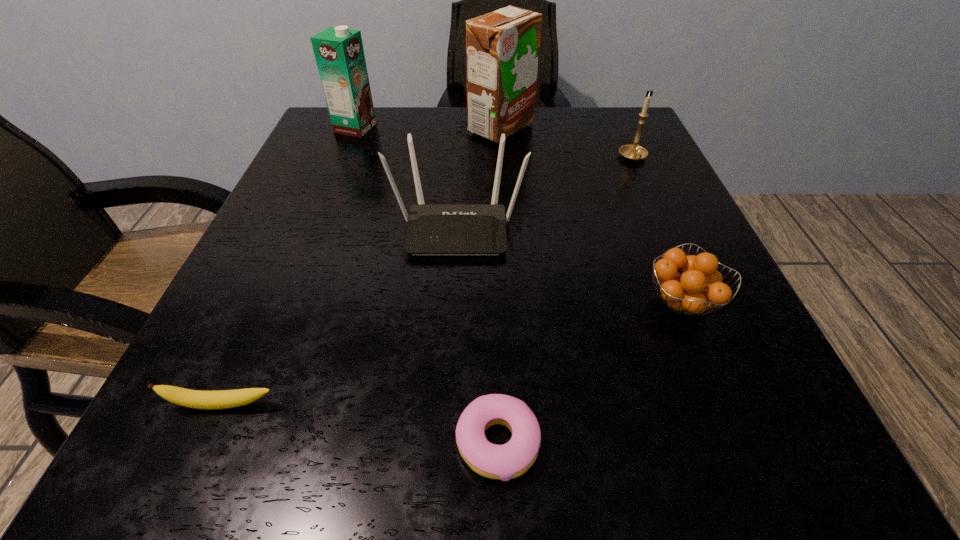
The height and width of the screenshot is (540, 960). What are the coordinates of `the right carton` in the screenshot? It's located at (502, 47).

At what (x,y) coordinates should I click in order to perform the action: click on the left carton. Please return your answer as a coordinate pair (x, y). The width and height of the screenshot is (960, 540). Looking at the image, I should click on (339, 53).

This screenshot has width=960, height=540. In order to click on candle holder in this screenshot , I will do `click(633, 152)`.

Locate an element on the screen. router is located at coordinates (432, 229).

The height and width of the screenshot is (540, 960). I want to click on orange fruit, so (x=699, y=288).

Identify the location of the fifth tallest object. The height and width of the screenshot is (540, 960). (699, 288).

Locate an element on the screen. Image resolution: width=960 pixels, height=540 pixels. banana is located at coordinates (209, 400).

Locate an element on the screen. the shortest object is located at coordinates pyautogui.click(x=504, y=462).

Where is `free point located 0.340m on the straw side of the right carton`? free point located 0.340m on the straw side of the right carton is located at coordinates (318, 129).

Locate an element on the screen. vacant space located 0.090m on the straw side of the right carton is located at coordinates (428, 129).